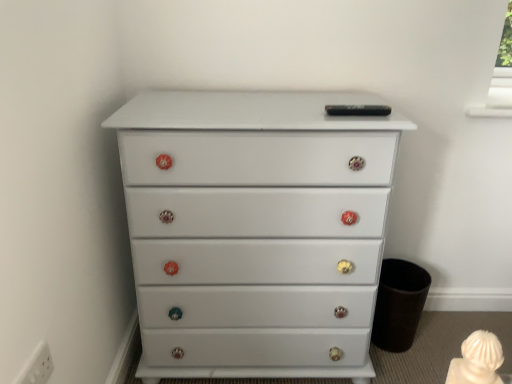
Question: From a real-world perspective, is white glossy chest of drawers at center positioned under white plastic electric outlet at lower left based on gravity?

Choices:
 (A) no
 (B) yes

Answer: (B)

Question: Is white glossy chest of drawers at center placed right next to white plastic electric outlet at lower left?

Choices:
 (A) yes
 (B) no

Answer: (B)

Question: Does white glossy chest of drawers at center have a greater height compared to white plastic electric outlet at lower left?

Choices:
 (A) yes
 (B) no

Answer: (A)

Question: Is the position of white glossy chest of drawers at center more distant than that of white plastic electric outlet at lower left?

Choices:
 (A) no
 (B) yes

Answer: (B)

Question: Does white glossy chest of drawers at center have a lesser height compared to white plastic electric outlet at lower left?

Choices:
 (A) yes
 (B) no

Answer: (B)

Question: Considering the relative positions of white glossy chest of drawers at center and white plastic electric outlet at lower left in the image provided, is white glossy chest of drawers at center to the right of white plastic electric outlet at lower left from the viewer's perspective?

Choices:
 (A) no
 (B) yes

Answer: (B)

Question: Is white plastic electric outlet at lower left facing towards white glossy chest of drawers at center?

Choices:
 (A) yes
 (B) no

Answer: (B)

Question: From the image's perspective, is white plastic electric outlet at lower left above white glossy chest of drawers at center?

Choices:
 (A) no
 (B) yes

Answer: (A)

Question: Is white plastic electric outlet at lower left positioned beyond the bounds of white glossy chest of drawers at center?

Choices:
 (A) yes
 (B) no

Answer: (A)

Question: Are white plastic electric outlet at lower left and white glossy chest of drawers at center beside each other?

Choices:
 (A) no
 (B) yes

Answer: (A)

Question: From the image's perspective, does white plastic electric outlet at lower left appear lower than white glossy chest of drawers at center?

Choices:
 (A) yes
 (B) no

Answer: (A)

Question: From a real-world perspective, does white plastic electric outlet at lower left stand above white glossy chest of drawers at center?

Choices:
 (A) no
 (B) yes

Answer: (B)

Question: Relative to white plastic electric outlet at lower left, is white glossy chest of drawers at center in front or behind?

Choices:
 (A) front
 (B) behind

Answer: (B)